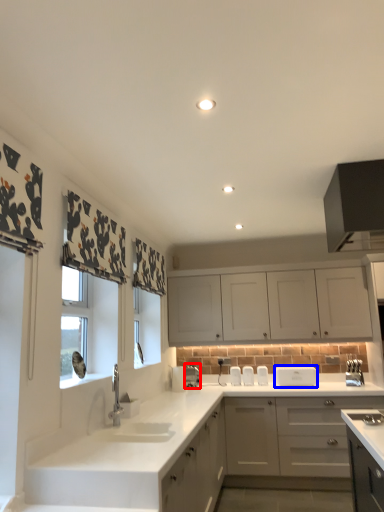
Question: Which object appears farthest to the camera in this image, appliance (highlighted by a red box) or appliance (highlighted by a blue box)?

Choices:
 (A) appliance
 (B) appliance

Answer: (A)